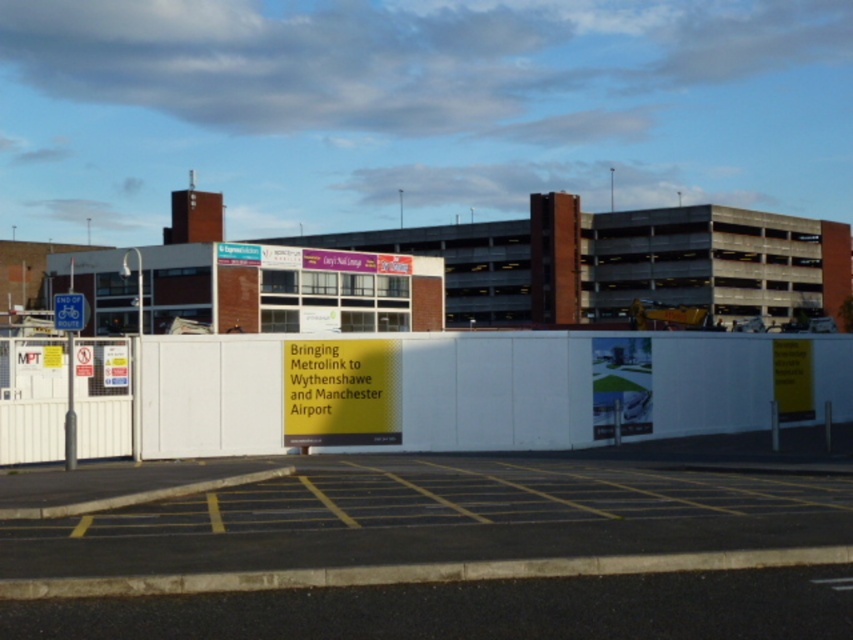
Question: Does white matte barrier at center have a greater width compared to blue plastic bicycle sign at left?

Choices:
 (A) yes
 (B) no

Answer: (A)

Question: Is white matte barrier at center closer to the viewer compared to blue plastic bicycle sign at left?

Choices:
 (A) yes
 (B) no

Answer: (B)

Question: Which of the following is the farthest from the observer?

Choices:
 (A) (839, 515)
 (B) (532, 333)
 (C) (61, 312)

Answer: (B)

Question: Can you confirm if yellow asphalt parking lot at lower center is smaller than white matte barrier at center?

Choices:
 (A) yes
 (B) no

Answer: (A)

Question: Which object appears closest to the camera in this image?

Choices:
 (A) white matte barrier at center
 (B) yellow asphalt parking lot at lower center

Answer: (B)

Question: Which of the following is the closest to the observer?

Choices:
 (A) (509, 397)
 (B) (73, 330)

Answer: (B)